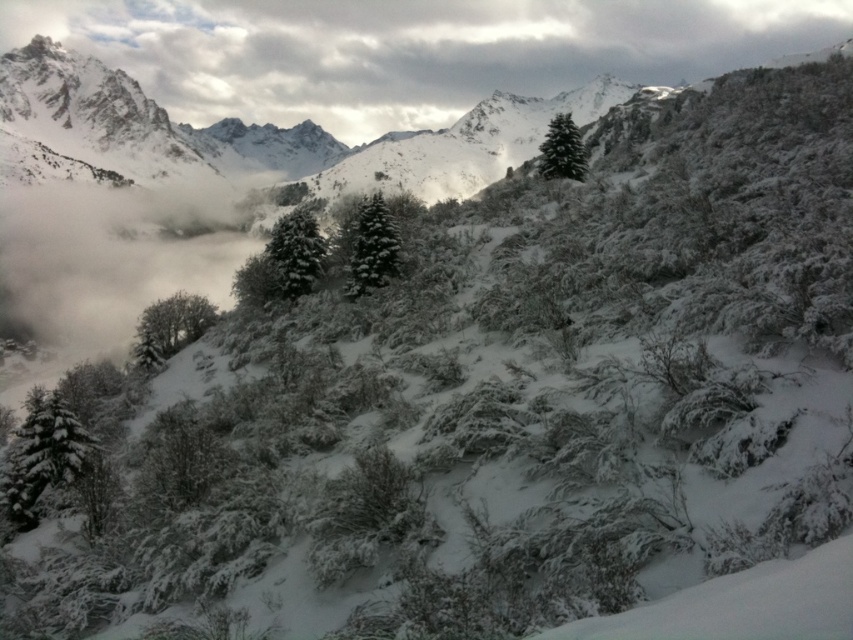
Question: Is green matte tree at lower left wider than green matte evergreen tree at center?

Choices:
 (A) yes
 (B) no

Answer: (A)

Question: Does green matte evergreen tree at center appear on the right side of green matte evergreen tree at upper center?

Choices:
 (A) yes
 (B) no

Answer: (B)

Question: Which object is farther from the camera taking this photo?

Choices:
 (A) snow-covered evergreen tree at lower left
 (B) green matte evergreen tree at center

Answer: (B)

Question: Estimate the real-world distances between objects in this image. Which object is farther from the white fluffy cloud at upper center?

Choices:
 (A) snow-covered evergreen tree at lower left
 (B) green matte tree at lower left

Answer: (A)

Question: Which point is closer to the camera taking this photo?

Choices:
 (A) pyautogui.click(x=300, y=259)
 (B) pyautogui.click(x=352, y=275)

Answer: (B)

Question: Observing the image, what is the correct spatial positioning of snow-covered evergreen tree at lower left in reference to green matte tree at lower left?

Choices:
 (A) right
 (B) left

Answer: (A)